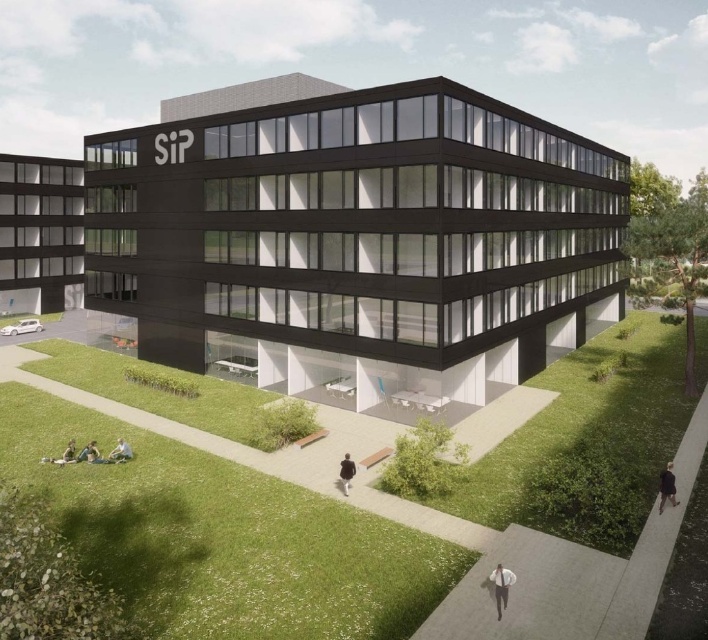
Based on the photo, is black glass building at center bigger than black fabric jacket at lower right?

Correct, black glass building at center is larger in size than black fabric jacket at lower right.

Can you confirm if black glass building at center is wider than black fabric jacket at lower right?

Indeed, black glass building at center has a greater width compared to black fabric jacket at lower right.

Between point (423, 81) and point (673, 476), which one is positioned in front?

Point (673, 476)

This screenshot has height=640, width=708. In order to click on black glass building at center in this screenshot , I will do `click(355, 237)`.

Is black matte jacket at center behind green fabric blanket at lower left?

That is False.

Image resolution: width=708 pixels, height=640 pixels. In order to click on black matte jacket at center in this screenshot , I will do `click(346, 472)`.

Is black glass building at center bigger than green fabric at lower left?

Indeed, black glass building at center has a larger size compared to green fabric at lower left.

Looking at this image, which is above, black glass building at center or green fabric at lower left?

Positioned higher is black glass building at center.

Is point (476, 205) positioned in front of point (84, 451)?

No.

Find the location of `black glass building at center`. black glass building at center is located at coordinates (355, 237).